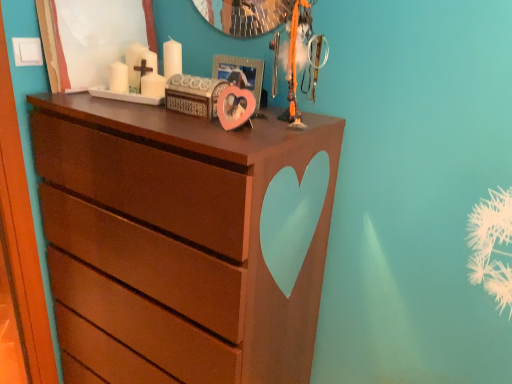
Where is `vacant area that is in front of pink matte heart at center`? The height and width of the screenshot is (384, 512). vacant area that is in front of pink matte heart at center is located at coordinates (261, 112).